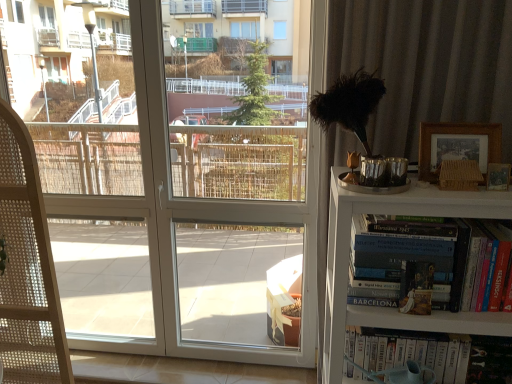
Question: From the image's perspective, is white glossy screen door at center positioned above or below woven wood folding chair at left?

Choices:
 (A) below
 (B) above

Answer: (B)

Question: Is white glossy screen door at center bigger or smaller than woven wood folding chair at left?

Choices:
 (A) small
 (B) big

Answer: (A)

Question: Based on their relative distances, which object is farther from the wooden picture frame at upper right, the first picture frame positioned from the top?

Choices:
 (A) hardcover book at right, arranged as the first book when viewed from the top
 (B) white glossy screen door at center
 (C) hardcover book at right
 (D) wooden picture frame at upper right, which appears as the second picture frame when viewed from the top
 (E) white wooden bookshelf at right

Answer: (B)

Question: Which object is positioned closest to the hardcover book at right?

Choices:
 (A) wooden picture frame at upper right, which is the 2th picture frame in bottom-to-top order
 (B) white wooden bookshelf at right
 (C) wooden picture frame at upper right, arranged as the first picture frame when ordered from the bottom
 (D) white glossy book at lower right, which is the second book in top-to-bottom order
 (E) hardcover book at right, arranged as the first book when viewed from the top

Answer: (E)